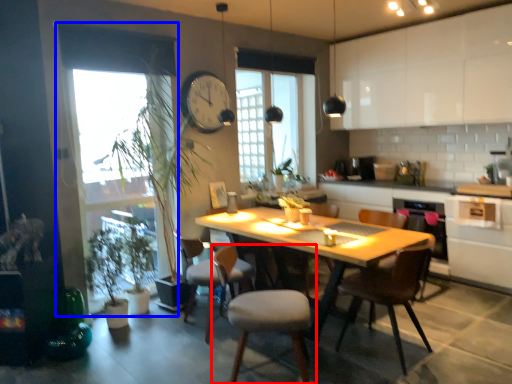
Question: Which object is further to the camera taking this photo, chair (highlighted by a red box) or window screen (highlighted by a blue box)?

Choices:
 (A) chair
 (B) window screen

Answer: (B)